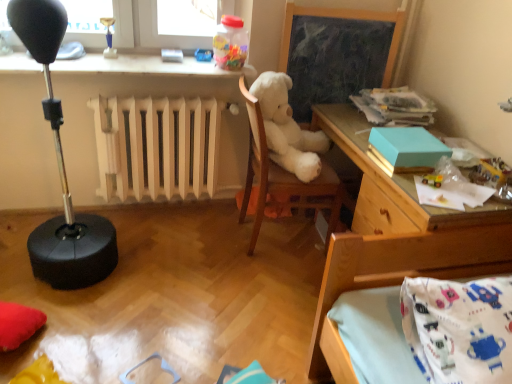
You are a GUI agent. You are given a task and a screenshot of the screen. Output one action in this format:
    pyautogui.click(x=<x>, y=<y>)
    Task: Click on the white plush teddy bear at center
    
    Given the screenshot: What is the action you would take?
    pyautogui.click(x=287, y=128)

The height and width of the screenshot is (384, 512). What do you see at coordinates (408, 147) in the screenshot? I see `teal matte box at upper right` at bounding box center [408, 147].

What is the approximate width of translucent plastic container at upper center, which is the third toy from right to left?

The width of translucent plastic container at upper center, which is the third toy from right to left, is 10.24 inches.

Find the location of a particular element. The height and width of the screenshot is (384, 512). wooden chalkboard at center is located at coordinates (336, 53).

I want to click on metallic silver toy at upper right, marked as the 3th toy in a top-to-bottom arrangement, so click(490, 173).

Can you confirm if translucent plastic container at upper center, which is the fourth toy in bottom-to-top order, is wider than white plush teddy bear at center?

No.

Which of these two, translucent plastic container at upper center, which appears as the 3th toy when viewed from the front, or white plush teddy bear at center, stands taller?

white plush teddy bear at center.

From the image's perspective, is translucent plastic container at upper center, the 1th toy when ordered from top to bottom, over white plush teddy bear at center?

Correct, translucent plastic container at upper center, the 1th toy when ordered from top to bottom, appears higher than white plush teddy bear at center in the image.

In terms of width, does white plush at center look wider or thinner when compared to white wooden radiator at center?

In the image, white plush at center appears to be wider than white wooden radiator at center.

Locate an element on the screen. radiator located above the white plush at center (from the image's perspective) is located at coordinates (157, 147).

Who is bigger, white plush at center or white wooden radiator at center?

white plush at center.

Would you say white plush at center is inside or outside white wooden radiator at center?

The correct answer is: outside.

Is white wooden radiator at center aimed at metallic silver toy at upper right, which appears as the fourth toy when viewed from the left?

No.

Does white wooden radiator at center come behind metallic silver toy at upper right, which is the first toy in right-to-left order?

Yes, it is.

Would you say white wooden radiator at center is inside or outside metallic silver toy at upper right, which appears as the fourth toy when viewed from the left?

white wooden radiator at center cannot be found inside metallic silver toy at upper right, which appears as the fourth toy when viewed from the left.

Does point (105, 156) come closer to viewer compared to point (475, 175)?

No.

Would you consider wooden desk at right to be distant from white plush teddy bear at center?

No, there isn't a large distance between wooden desk at right and white plush teddy bear at center.

Between wooden desk at right and white plush teddy bear at center, which one has more height?

wooden desk at right is taller.

Between wooden desk at right and white plush teddy bear at center, which one is positioned behind?

white plush teddy bear at center is further away from the camera.

Is wooden desk at right wider or thinner than white plush teddy bear at center?

Clearly, wooden desk at right has more width compared to white plush teddy bear at center.

Where is `the 1st toy above the wooden chalkboard at center (from the image's perspective)`? the 1st toy above the wooden chalkboard at center (from the image's perspective) is located at coordinates (203, 55).

Can you confirm if blue plastic toy at upper center, placed as the third toy when sorted from bottom to top, is wider than wooden chalkboard at center?

Yes.

Is blue plastic toy at upper center, the second toy viewed from the top, inside the boundaries of wooden chalkboard at center, or outside?

blue plastic toy at upper center, the second toy viewed from the top, lies outside wooden chalkboard at center.

Who is taller, translucent plastic container at upper center, the 2th toy viewed from the back, or wooden chalkboard at center?

Standing taller between the two is wooden chalkboard at center.

Find the location of `toy that is the 1st one when counting forward from the wooden chalkboard at center`. toy that is the 1st one when counting forward from the wooden chalkboard at center is located at coordinates (230, 43).

Between point (233, 49) and point (335, 87), which one is positioned behind?

The point (335, 87) is farther.

Does translucent plastic container at upper center, the 1th toy when ordered from top to bottom, appear on the right side of wooden chalkboard at center?

No, translucent plastic container at upper center, the 1th toy when ordered from top to bottom, is not to the right of wooden chalkboard at center.

Between point (238, 57) and point (201, 53), which one is positioned behind?

The point (201, 53) is farther.

Could you tell me if translucent plastic container at upper center, the 2th toy viewed from the back, is turned towards blue plastic toy at upper center, which appears as the fourth toy when viewed from the front?

No, translucent plastic container at upper center, the 2th toy viewed from the back, is not oriented towards blue plastic toy at upper center, which appears as the fourth toy when viewed from the front.

Who is smaller, translucent plastic container at upper center, the 1th toy when ordered from top to bottom, or blue plastic toy at upper center, positioned as the fourth toy in right-to-left order?

blue plastic toy at upper center, positioned as the fourth toy in right-to-left order.

Based on the photo, between translucent plastic container at upper center, the 2th toy viewed from the back, and blue plastic toy at upper center, placed as the third toy when sorted from bottom to top, which one has less height?

blue plastic toy at upper center, placed as the third toy when sorted from bottom to top.

I want to click on the 2nd toy above the white plush teddy bear at center (from the image's perspective), so click(230, 43).

Find the location of a particular element. Image resolution: width=512 pixels, height=384 pixels. radiator that appears on the left of white plush at center is located at coordinates (157, 147).

Estimate the real-world distances between objects in this image. Which object is closer to white wooden radiator at center, blue plastic toy at upper center, which appears as the fourth toy when viewed from the front, or metallic silver toy at upper right, the 3th toy from the back?

blue plastic toy at upper center, which appears as the fourth toy when viewed from the front, is positioned closer to the anchor white wooden radiator at center.

Estimate the real-world distances between objects in this image. Which object is further from metallic yellow toy car at upper right, the fourth toy when ordered from back to front, translucent plastic container at upper center, which appears as the 3th toy when viewed from the front, or white plush at center?

translucent plastic container at upper center, which appears as the 3th toy when viewed from the front, is positioned further to the anchor metallic yellow toy car at upper right, the fourth toy when ordered from back to front.

Which object lies further to the anchor point teal matte box at upper right, wooden desk at right or blue plastic toy at upper center, the first toy viewed from the left?

blue plastic toy at upper center, the first toy viewed from the left.

When comparing their distances from wooden desk at right, does white plush teddy bear at center or metallic silver toy at upper right, which appears as the fourth toy when viewed from the left, seem closer?

The object closer to wooden desk at right is white plush teddy bear at center.

Which object lies further to the anchor point wooden chalkboard at center, teal matte box at upper right or blue plastic toy at upper center, positioned as the fourth toy in right-to-left order?

blue plastic toy at upper center, positioned as the fourth toy in right-to-left order, is positioned further to the anchor wooden chalkboard at center.

Looking at this image, considering their positions, is blue plastic toy at upper center, positioned as the fourth toy in right-to-left order, positioned further to wooden chalkboard at center than metallic silver toy at upper right, which is the second toy from front to back?

metallic silver toy at upper right, which is the second toy from front to back, is further to wooden chalkboard at center.

From the image, which object appears to be farther from blue plastic toy at upper center, the first toy viewed from the back, white plush teddy bear at center or wooden desk at right?

wooden desk at right.

Which object lies further to the anchor point white plush teddy bear at center, metallic silver toy at upper right, the 3th toy from the back, or white wooden radiator at center?

metallic silver toy at upper right, the 3th toy from the back, is positioned further to the anchor white plush teddy bear at center.

Where is `toy between white plush teddy bear at center and wooden desk at right from left to right`? toy between white plush teddy bear at center and wooden desk at right from left to right is located at coordinates (432, 180).

I want to click on chair between white wooden radiator at center and metallic silver toy at upper right, which is the second toy from front to back, in the horizontal direction, so click(286, 154).

Find the location of a particular element. The width and height of the screenshot is (512, 384). desk between metallic yellow toy car at upper right, the first toy when ordered from bottom to top, and metallic silver toy at upper right, which is the first toy in right-to-left order is located at coordinates (395, 239).

Find the location of a particular element. bulletin board situated between white wooden radiator at center and teal matte box at upper right from left to right is located at coordinates (336, 53).